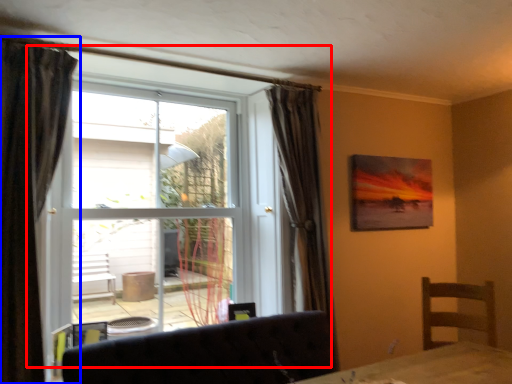
Question: Which point is closer to the camera, window (highlighted by a red box) or curtain (highlighted by a blue box)?

Choices:
 (A) window
 (B) curtain

Answer: (B)